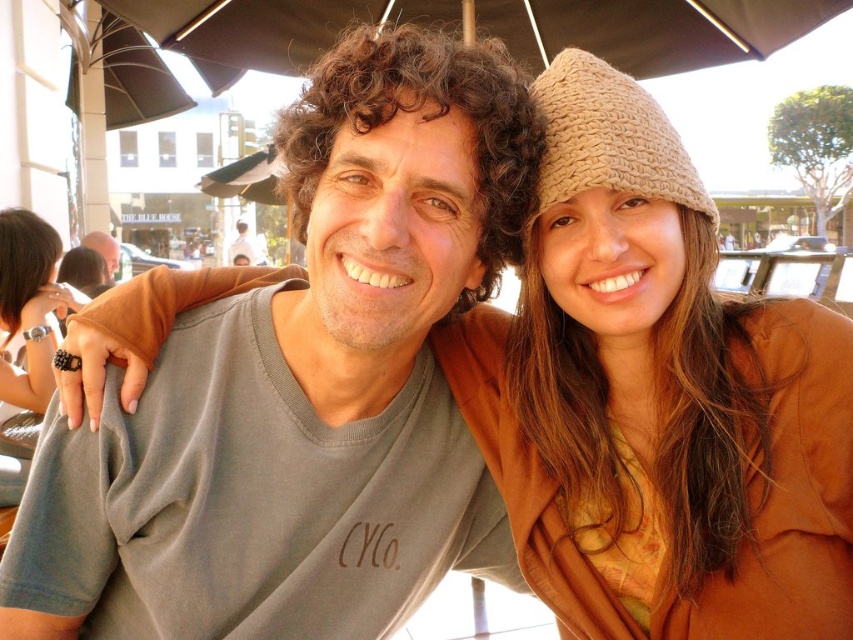
Is brown knitted hat at upper right positioned in front of brown woven umbrella at upper center?

Yes, it is.

The width and height of the screenshot is (853, 640). What do you see at coordinates (664, 397) in the screenshot? I see `brown knitted hat at upper right` at bounding box center [664, 397].

Measure the distance between point [662,541] and camera.

A distance of 2.31 meters exists between point [662,541] and camera.

Image resolution: width=853 pixels, height=640 pixels. Find the location of `brown knitted hat at upper right`. brown knitted hat at upper right is located at coordinates (664, 397).

Who is more forward, (848, 472) or (112, 248)?

Point (848, 472) is more forward.

The image size is (853, 640). I want to click on brown knitted hat at upper right, so click(x=664, y=397).

Is brown woven umbrella at upper center above matte gray t-shirt at center?

No, brown woven umbrella at upper center is not above matte gray t-shirt at center.

Can you confirm if brown woven umbrella at upper center is positioned to the left of matte gray t-shirt at center?

Incorrect, brown woven umbrella at upper center is not on the left side of matte gray t-shirt at center.

Who is more distant from viewer, (x=683, y=38) or (x=248, y=250)?

The point (x=248, y=250) is behind.

Image resolution: width=853 pixels, height=640 pixels. Identify the location of brown woven umbrella at upper center. 653,29.